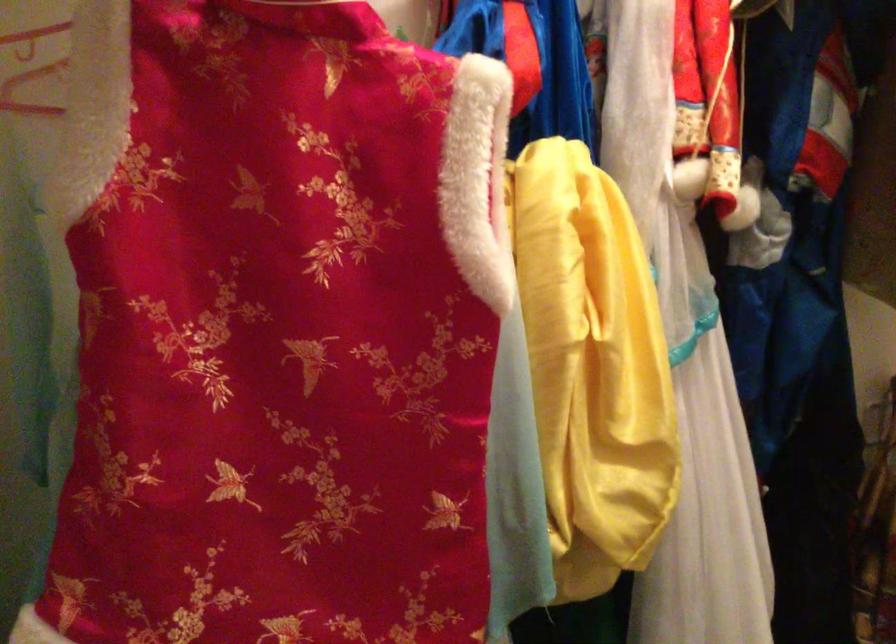
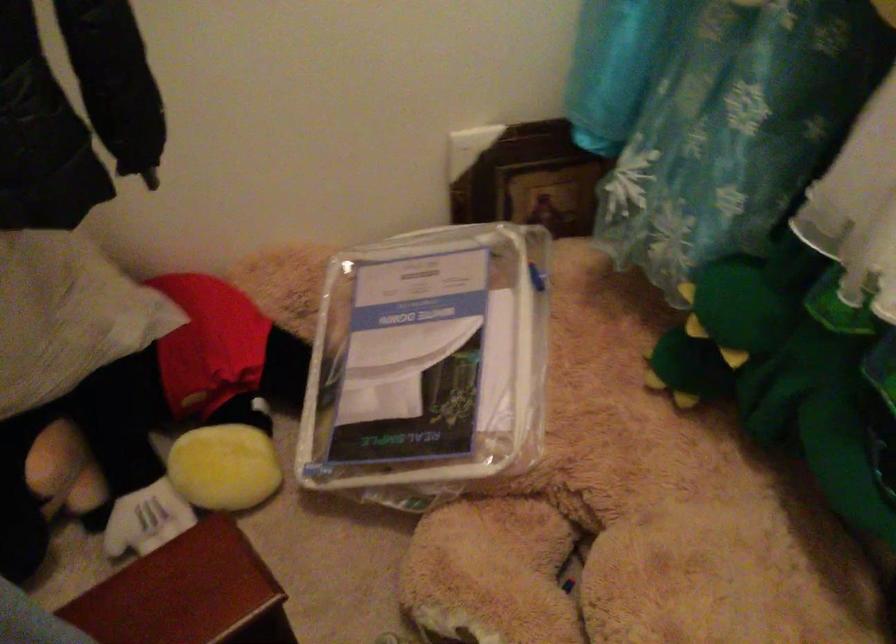
The images are taken continuously from a first-person perspective. In which direction is your viewpoint rotating?

The rotation direction of the camera is left-down.